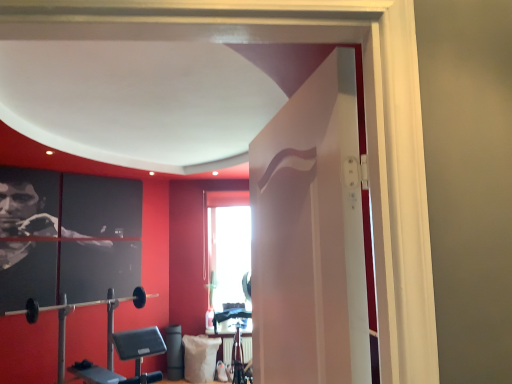
Question: Considering the relative sizes of black rubber barbell at lower left and white fabric pillow at lower center in the image provided, is black rubber barbell at lower left thinner than white fabric pillow at lower center?

Choices:
 (A) no
 (B) yes

Answer: (B)

Question: Is black rubber barbell at lower left further to camera compared to white fabric pillow at lower center?

Choices:
 (A) yes
 (B) no

Answer: (B)

Question: Is black rubber barbell at lower left to the right of white fabric pillow at lower center from the viewer's perspective?

Choices:
 (A) yes
 (B) no

Answer: (B)

Question: Would you consider black rubber barbell at lower left to be distant from white fabric pillow at lower center?

Choices:
 (A) no
 (B) yes

Answer: (B)

Question: Is black rubber barbell at lower left outside of white fabric pillow at lower center?

Choices:
 (A) yes
 (B) no

Answer: (A)

Question: Looking at their shapes, would you say white glossy door at center is wider or thinner than black rubber barbell at lower left?

Choices:
 (A) thin
 (B) wide

Answer: (A)

Question: Is white glossy door at center inside or outside of black rubber barbell at lower left?

Choices:
 (A) inside
 (B) outside

Answer: (B)

Question: Is point (288, 216) closer or farther from the camera than point (33, 301)?

Choices:
 (A) closer
 (B) farther

Answer: (A)

Question: Based on their positions, is white glossy door at center located to the left or right of black rubber barbell at lower left?

Choices:
 (A) right
 (B) left

Answer: (A)

Question: From the image's perspective, relative to white fabric pillow at lower center, is black rubber barbell at lower left above or below?

Choices:
 (A) below
 (B) above

Answer: (B)

Question: Is black rubber barbell at lower left taller or shorter than white fabric pillow at lower center?

Choices:
 (A) tall
 (B) short

Answer: (B)

Question: Is black rubber barbell at lower left situated inside white fabric pillow at lower center or outside?

Choices:
 (A) inside
 (B) outside

Answer: (B)

Question: From a real-world perspective, relative to white fabric pillow at lower center, is black rubber barbell at lower left vertically above or below?

Choices:
 (A) below
 (B) above

Answer: (B)

Question: Looking at the image, does white fabric pillow at lower center seem bigger or smaller compared to black rubber barbell at lower left?

Choices:
 (A) small
 (B) big

Answer: (A)

Question: In terms of width, does white fabric pillow at lower center look wider or thinner when compared to black rubber barbell at lower left?

Choices:
 (A) thin
 (B) wide

Answer: (B)